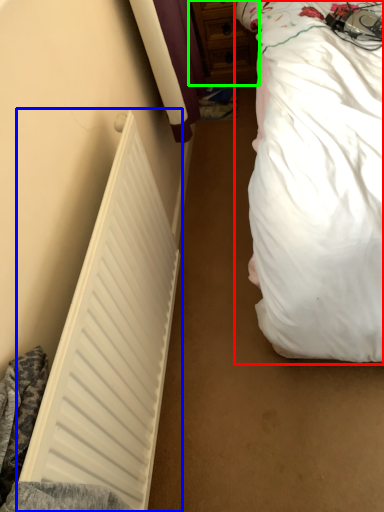
Question: Which object is positioned farthest from bed (highlighted by a red box)? Select from radiator (highlighted by a blue box) and dresser (highlighted by a green box).

Choices:
 (A) radiator
 (B) dresser

Answer: (B)